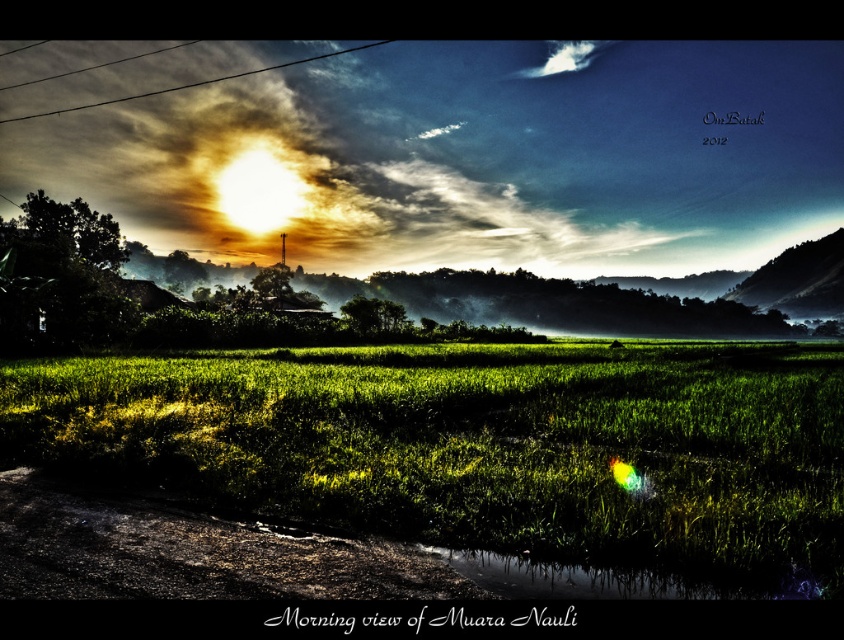
You are a landscape photographer planning to capture the green grass at center and the metallic wire at upper left in your shot. Based on their sizes, which object would appear smaller in the final photograph?

The green grass at center would appear smaller in the photograph because it is thinner than the metallic wire at upper left.

You are standing at the dirt path in the Muara Nauli scene and want to walk towards the point labeled as point (x=258, y=68). However, there is an obstacle at point (x=349, y=365). Will you encounter this obstacle before reaching your destination?

Yes, you will encounter the obstacle at point (x=349, y=365) before reaching point (x=258, y=68) because point (x=349, y=365) is in front of point (x=258, y=68).